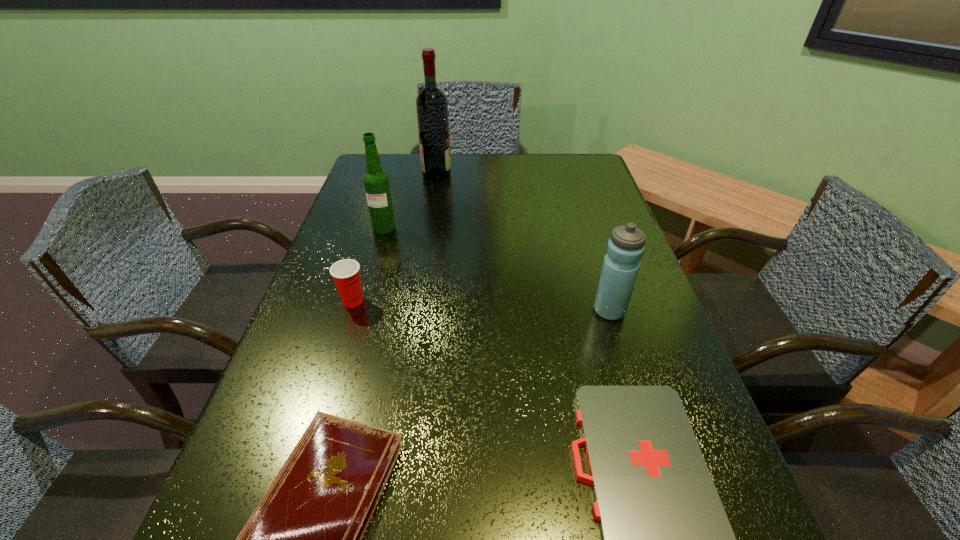
Identify the location of beer bottle positioned at the left edge. This screenshot has width=960, height=540. (376, 181).

Where is `Dixie cup that is positioned at the left edge`? Dixie cup that is positioned at the left edge is located at coordinates [x=346, y=273].

I want to click on object that is at the right edge, so click(625, 248).

Find the location of `free point at the far edge`. free point at the far edge is located at coordinates (509, 172).

This screenshot has width=960, height=540. I want to click on vacant space at the left edge of the desktop, so click(289, 364).

In the image, there is a desktop. At what (x,y) coordinates should I click in order to perform the action: click on free region at the right edge. Please return your answer as a coordinate pair (x, y). The image size is (960, 540). Looking at the image, I should click on (606, 210).

Locate an element on the screen. Image resolution: width=960 pixels, height=540 pixels. free location at the far left corner is located at coordinates (362, 174).

At what (x,y) coordinates should I click in order to perform the action: click on vacant area that lies between the fifth nearest object and the Dixie cup. Please return your answer as a coordinate pair (x, y). The width and height of the screenshot is (960, 540). Looking at the image, I should click on (369, 265).

The width and height of the screenshot is (960, 540). Find the location of `vacant area between the beer bottle and the third tallest object`. vacant area between the beer bottle and the third tallest object is located at coordinates (496, 269).

The width and height of the screenshot is (960, 540). I want to click on unoccupied area between the second farthest object and the water bottle, so click(496, 269).